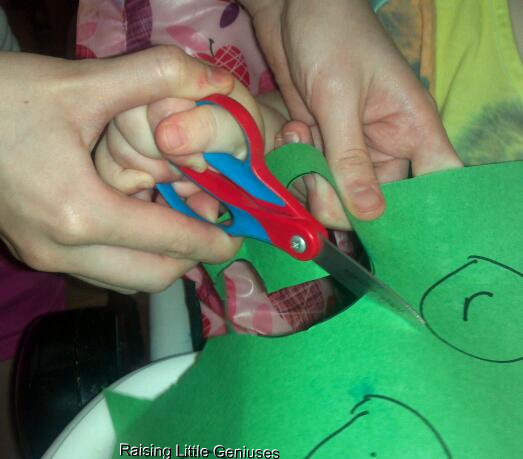
The image size is (523, 459). I want to click on yellow fabric, so click(x=488, y=51).